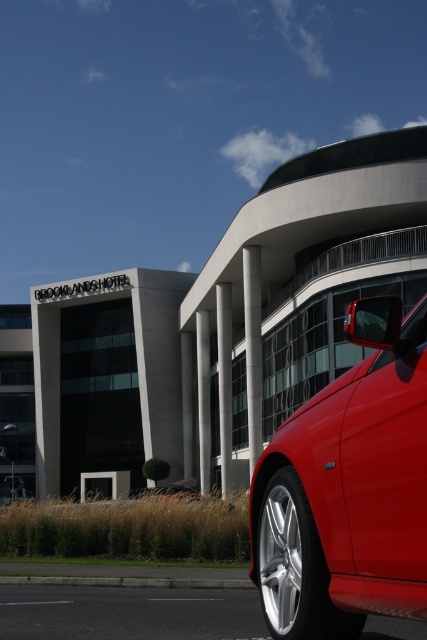
Question: Which of the following is the closest to the observer?

Choices:
 (A) satin silver column at center
 (B) sleek metallic pole at center
 (C) glossy red car at right

Answer: (C)

Question: Can you confirm if sleek metallic pole at center is positioned below satin silver column at center?

Choices:
 (A) yes
 (B) no

Answer: (B)

Question: In this image, where is glossy red car at right located relative to grassy park at lower left?

Choices:
 (A) above
 (B) below

Answer: (A)

Question: Can you confirm if glossy red car at right is positioned above white smooth pillar at center?

Choices:
 (A) no
 (B) yes

Answer: (B)

Question: Which of the following is the closest to the observer?

Choices:
 (A) sleek metallic pole at center
 (B) gray concrete pillar at center
 (C) glossy red car at right
 (D) white smooth pillar at center

Answer: (C)

Question: Which of the following is the farthest from the observer?

Choices:
 (A) (260, 451)
 (B) (184, 371)
 (C) (316, 604)
 (D) (201, 426)

Answer: (B)